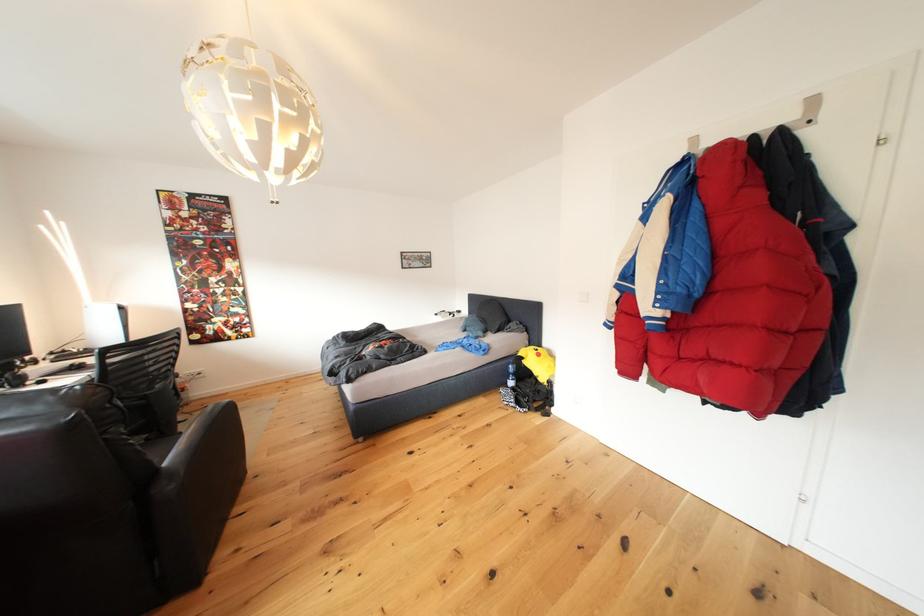
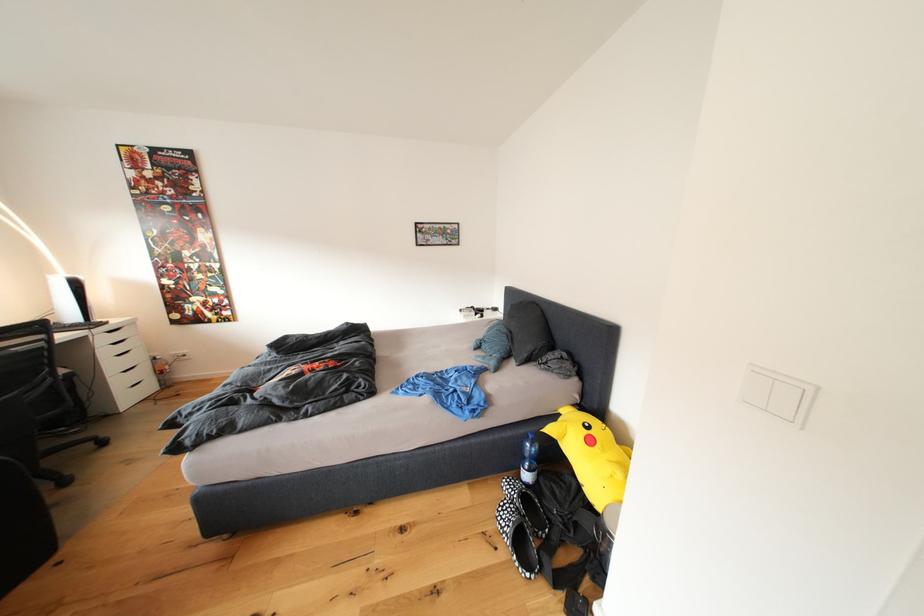
The point at (548,360) is marked in the first image. Where is the corresponding point in the second image?

(600, 446)